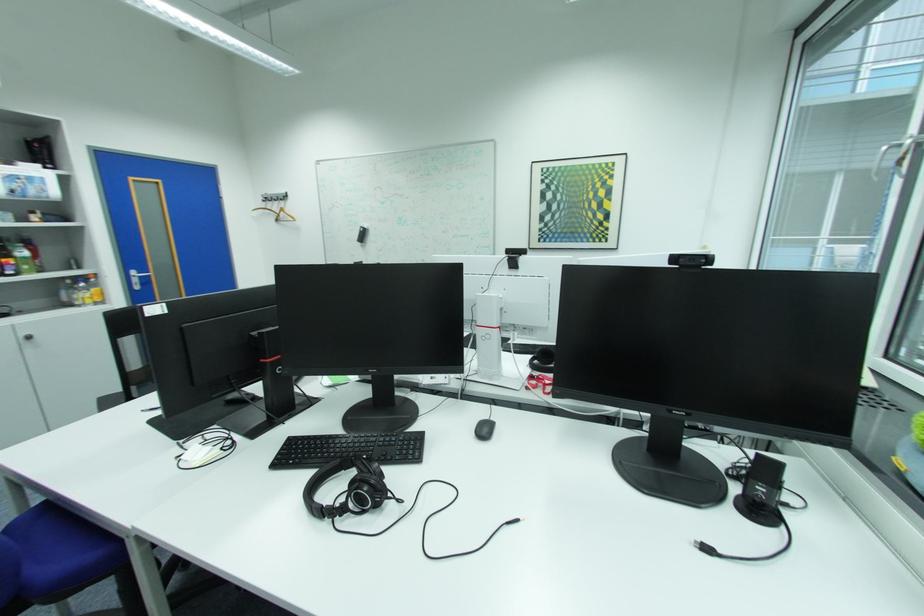
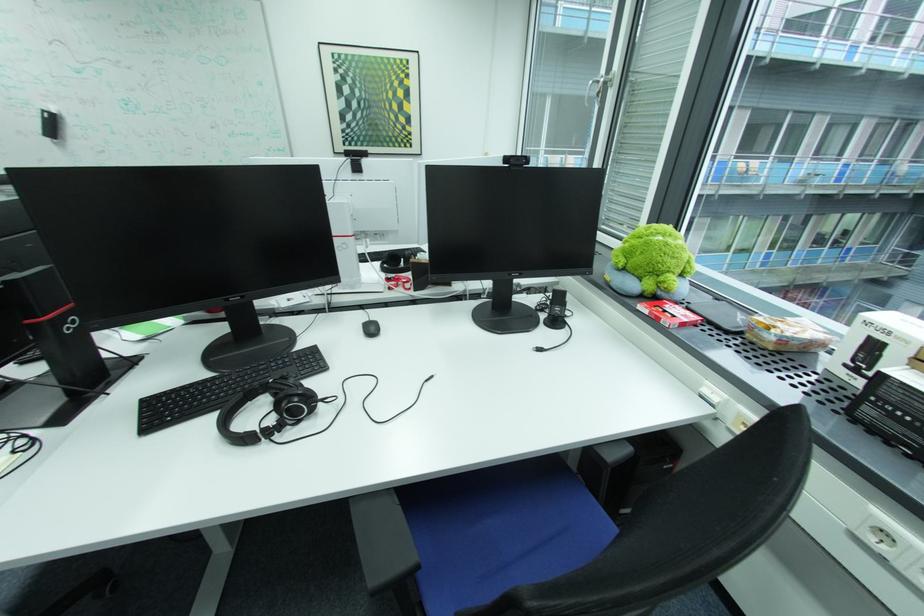
Find the pixel in the second image that matches point 274,363 in the first image.

(47, 323)